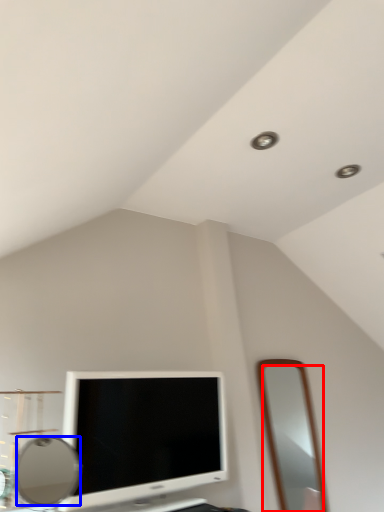
Question: Which object appears farthest to the camera in this image, mirror (highlighted by a red box) or mirror (highlighted by a blue box)?

Choices:
 (A) mirror
 (B) mirror

Answer: (A)